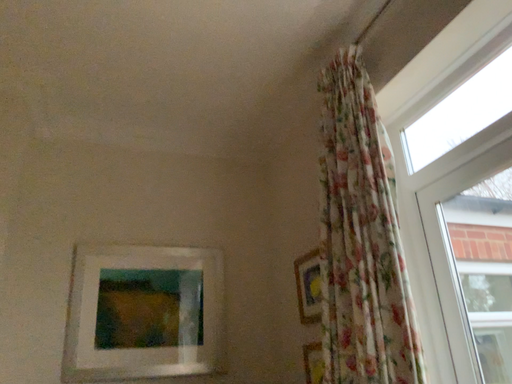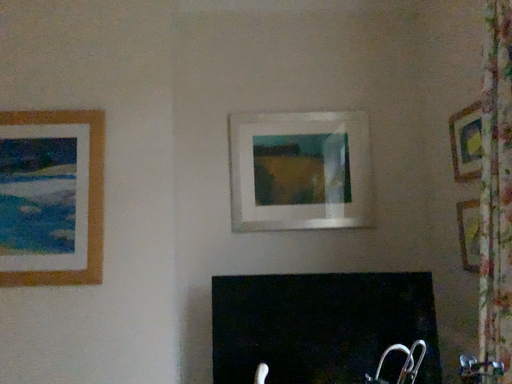
Question: How did the camera likely rotate when shooting the video?

Choices:
 (A) rotated right
 (B) rotated left

Answer: (B)